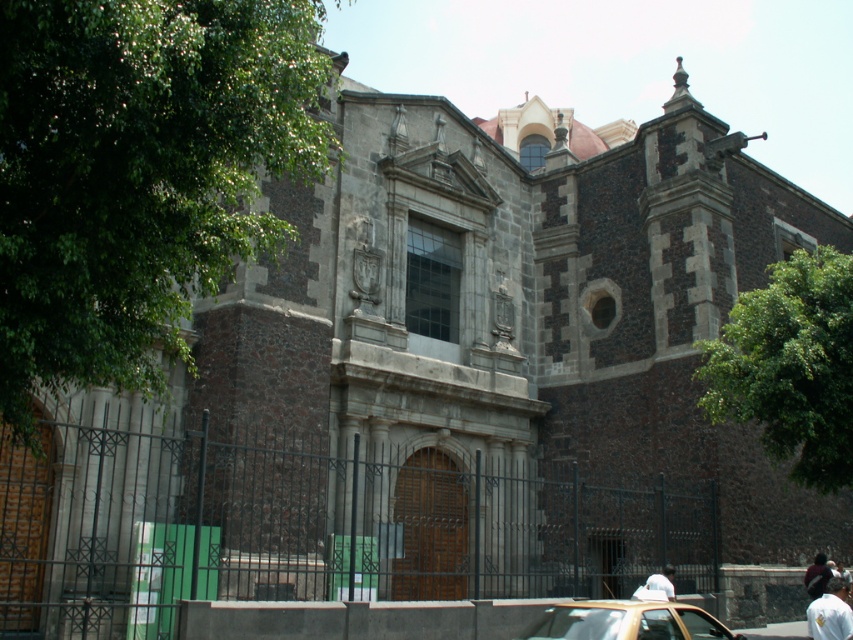
Question: Is white fabric shirt at lower right below dark brown leather jacket at center?

Choices:
 (A) yes
 (B) no

Answer: (B)

Question: Does gold metallic car at lower center appear on the right side of white fabric shirt at lower right?

Choices:
 (A) no
 (B) yes

Answer: (A)

Question: Which of the following is the farthest from the observer?

Choices:
 (A) dark brown leather jacket at center
 (B) gold metallic car at lower center
 (C) white fabric shirt at lower right

Answer: (A)

Question: Which object is closer to the camera taking this photo?

Choices:
 (A) dark brown leather jacket at center
 (B) gold metallic car at lower center

Answer: (B)

Question: Considering the real-world distances, which object is farthest from the gold metallic car at lower center?

Choices:
 (A) white fabric shirt at lower right
 (B) dark brown leather jacket at center

Answer: (B)

Question: Is gold metallic car at lower center to the left of dark brown leather jacket at center from the viewer's perspective?

Choices:
 (A) yes
 (B) no

Answer: (A)